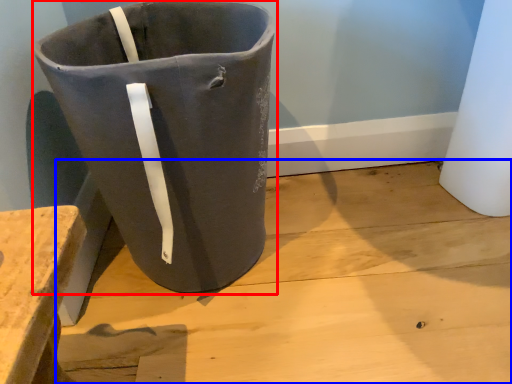
Question: Which of the following is the closest to the observer, waste container (highlighted by a red box) or concrete (highlighted by a blue box)?

Choices:
 (A) waste container
 (B) concrete

Answer: (A)